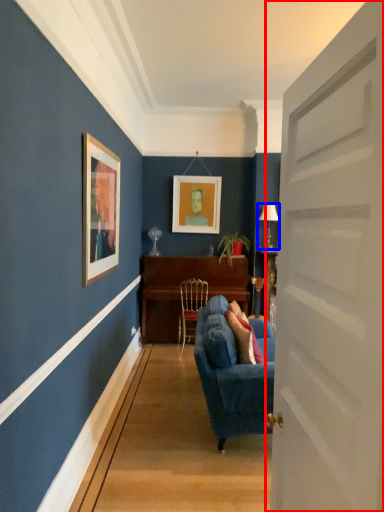
Question: Which object appears farthest to the camera in this image, door (highlighted by a red box) or lamp (highlighted by a blue box)?

Choices:
 (A) door
 (B) lamp

Answer: (B)